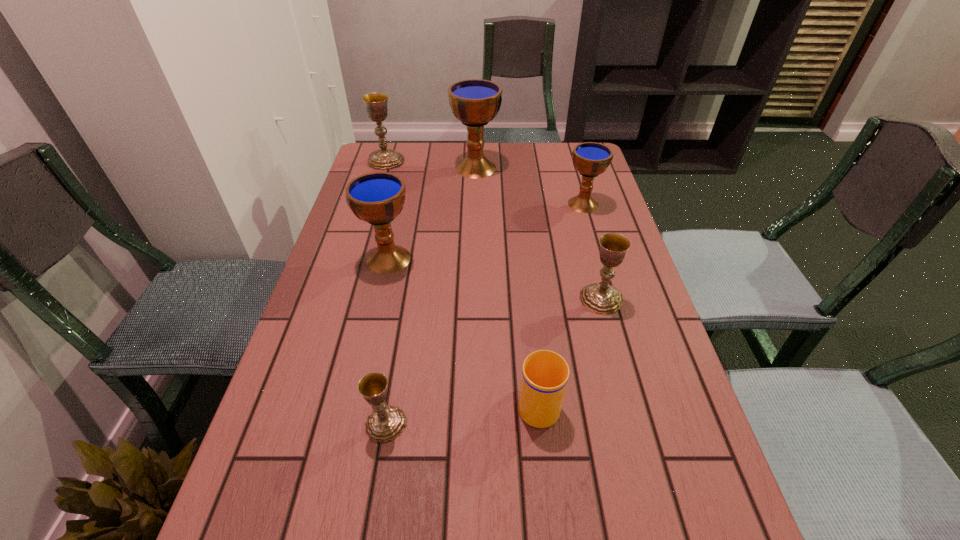
Where is `blank space located 0.350m on the side of the beige cup with the handle`? blank space located 0.350m on the side of the beige cup with the handle is located at coordinates (523, 264).

Identify the location of free spot located on the side of the beige cup with the handle. The width and height of the screenshot is (960, 540). (523, 264).

The width and height of the screenshot is (960, 540). What are the coordinates of `free location located on the left of the second gold chalice from left to right` in the screenshot? It's located at (333, 424).

The image size is (960, 540). Find the location of `object present at the far left corner`. object present at the far left corner is located at coordinates (376, 103).

At what (x,y) coordinates should I click in order to perform the action: click on blank space at the far edge of the desktop. Please return your answer as a coordinate pair (x, y). The height and width of the screenshot is (540, 960). Looking at the image, I should click on (530, 172).

Identify the location of free space at the left edge of the desktop. This screenshot has height=540, width=960. (353, 371).

Find the location of a particular element. free location at the right edge is located at coordinates (627, 292).

In the image, there is a desktop. Find the location of `vacant space at the far right corner`. vacant space at the far right corner is located at coordinates (564, 175).

Image resolution: width=960 pixels, height=540 pixels. I want to click on blank region between the fourth farthest object and the third object from right to left, so click(464, 330).

Locate an element on the screen. The width and height of the screenshot is (960, 540). vacant area that lies between the tallest object and the second smallest blue chalice is located at coordinates (432, 213).